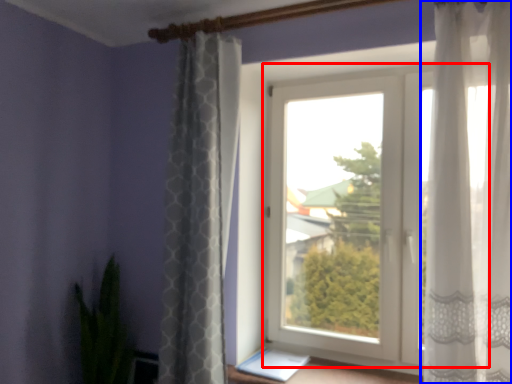
Question: Which point is further to the camera, window (highlighted by a red box) or curtain (highlighted by a blue box)?

Choices:
 (A) window
 (B) curtain

Answer: (A)